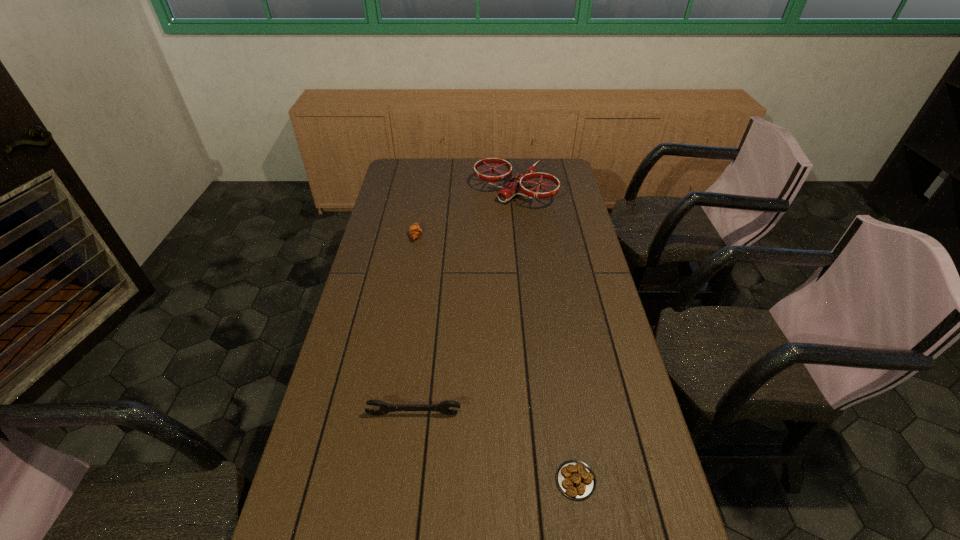
I want to click on vacant space at the right edge, so click(561, 198).

Locate an element on the screen. This screenshot has width=960, height=540. vacant space at the far left corner of the desktop is located at coordinates (393, 165).

This screenshot has width=960, height=540. In the image, there is a desktop. What are the coordinates of `blank space at the far right corner` in the screenshot? It's located at (547, 158).

The width and height of the screenshot is (960, 540). I want to click on free space between the farthest object and the second tallest object, so click(464, 302).

Locate an element on the screen. This screenshot has width=960, height=540. empty space between the farthest object and the right pastry is located at coordinates (545, 335).

Image resolution: width=960 pixels, height=540 pixels. In order to click on vacant area between the farther pastry and the nearest object in this screenshot , I will do `click(495, 357)`.

This screenshot has width=960, height=540. Find the location of `empty space that is in between the farther pastry and the wrench`. empty space that is in between the farther pastry and the wrench is located at coordinates (x=415, y=325).

Image resolution: width=960 pixels, height=540 pixels. Identify the location of vacant region between the farthest object and the taller pastry. (466, 213).

Identify the location of vacant area between the shorter pastry and the taller pastry. (495, 357).

Where is `vacant space that is in between the shortest object and the tallest object`? Image resolution: width=960 pixels, height=540 pixels. vacant space that is in between the shortest object and the tallest object is located at coordinates (545, 335).